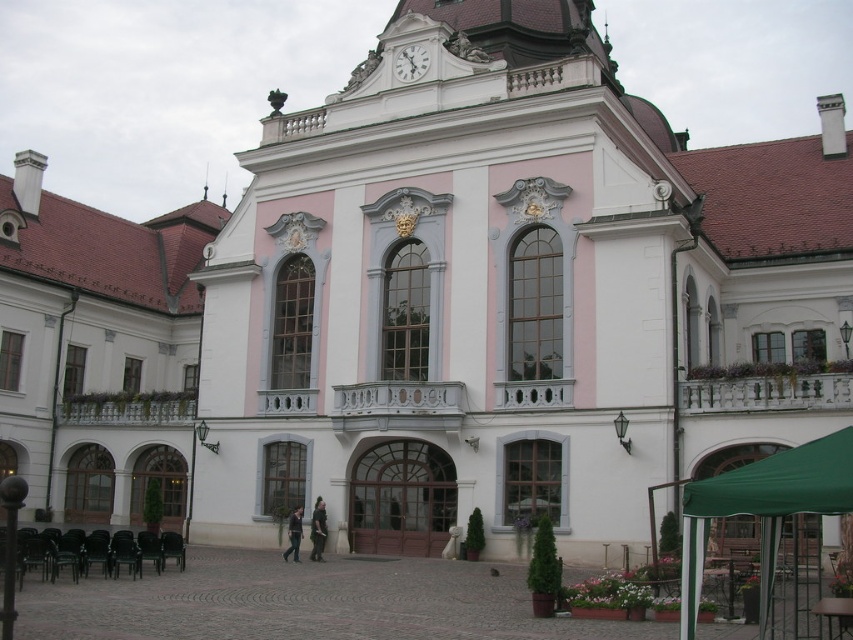
Question: Which point appears closest to the camera in this image?

Choices:
 (A) (407, 81)
 (B) (805, 500)

Answer: (B)

Question: From the image, what is the correct spatial relationship of green fabric canopy at lower right in relation to white glossy clock at upper center?

Choices:
 (A) left
 (B) right

Answer: (B)

Question: In this image, where is green fabric canopy at lower right located relative to white glossy clock at upper center?

Choices:
 (A) right
 (B) left

Answer: (A)

Question: Which of the following is the farthest from the observer?

Choices:
 (A) (837, 470)
 (B) (412, 74)

Answer: (B)

Question: Is green fabric canopy at lower right positioned at the back of white glossy clock at upper center?

Choices:
 (A) no
 (B) yes

Answer: (A)